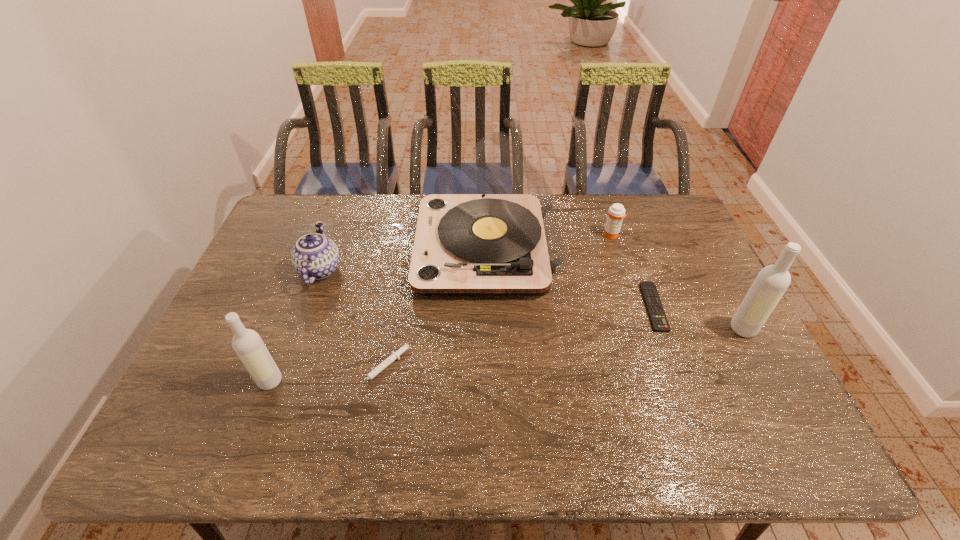
Find the location of a particular element. the left vodka is located at coordinates [248, 345].

Identify the location of the shorter vodka. (248, 345).

Image resolution: width=960 pixels, height=540 pixels. Find the location of `the right vodka`. the right vodka is located at coordinates (771, 283).

I want to click on the farther vodka, so click(x=771, y=283).

The image size is (960, 540). Find the location of `record player`. record player is located at coordinates (505, 241).

The height and width of the screenshot is (540, 960). I want to click on the fifth tallest object, so click(616, 213).

Locate an element on the screen. Image resolution: width=960 pixels, height=540 pixels. chinaware is located at coordinates (314, 256).

Image resolution: width=960 pixels, height=540 pixels. In order to click on the shortest object in this screenshot , I will do [657, 316].

The image size is (960, 540). Identify the location of syringe. (395, 355).

Locate an element on the screen. Image resolution: width=960 pixels, height=540 pixels. free space located 0.170m on the back of the nearer vodka is located at coordinates (294, 319).